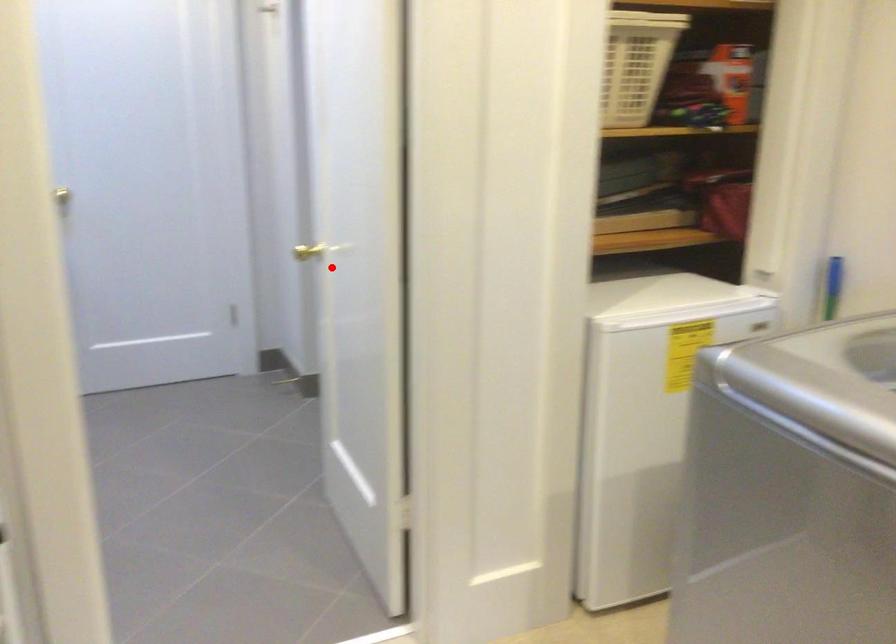
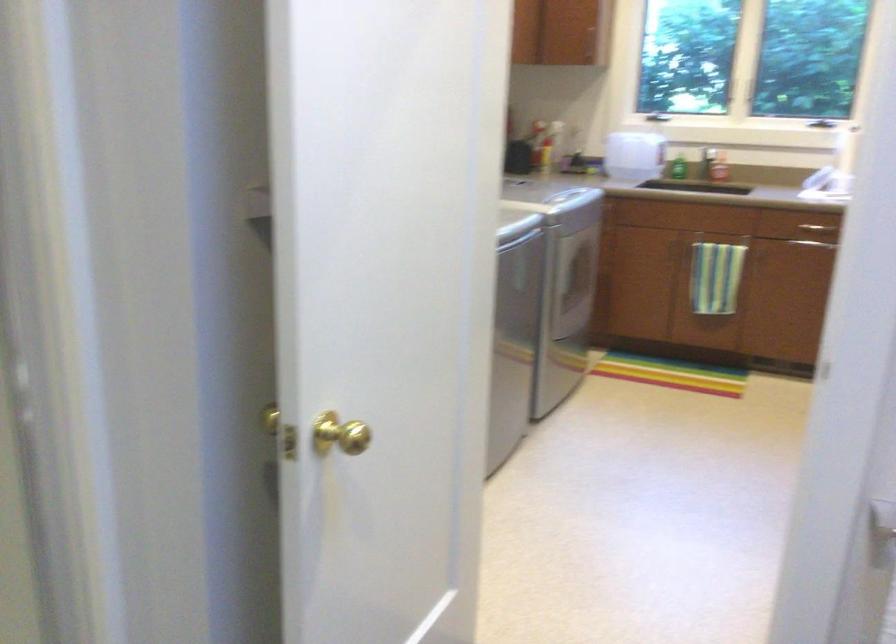
Find the pixel in the second image that matches the highlighted location in the first image.

(339, 433)